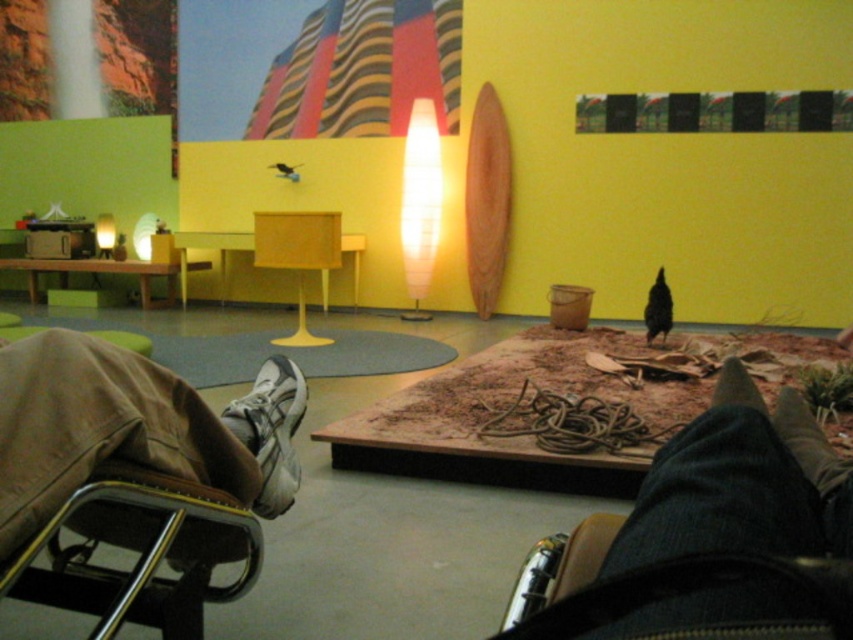
Does metallic silver folding chair at lower left have a larger size compared to white mesh shoe at lower left?

Correct, metallic silver folding chair at lower left is larger in size than white mesh shoe at lower left.

Does metallic silver folding chair at lower left have a lesser width compared to white mesh shoe at lower left?

In fact, metallic silver folding chair at lower left might be wider than white mesh shoe at lower left.

Identify the location of metallic silver folding chair at lower left. The image size is (853, 640). (102, 433).